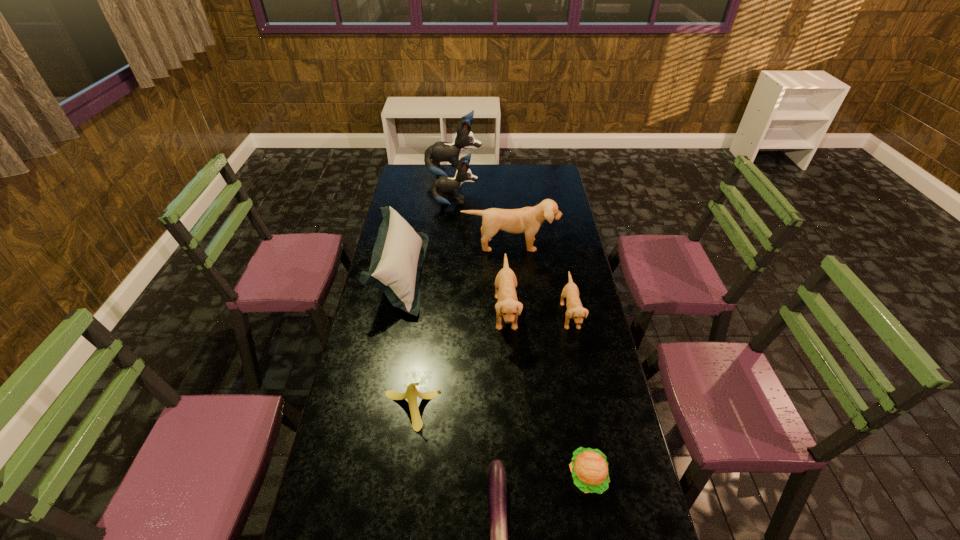
This screenshot has width=960, height=540. What are the coordinates of `the tallest puppy` in the screenshot? It's located at (440, 151).

Image resolution: width=960 pixels, height=540 pixels. What are the coordinates of `the tallest object` in the screenshot? It's located at (440, 151).

At what (x,y) coordinates should I click in order to perform the action: click on the fourth nearest puppy. Please return your answer as a coordinate pair (x, y). Image resolution: width=960 pixels, height=540 pixels. Looking at the image, I should click on (444, 184).

Identify the location of the nearer black puppy. The image size is (960, 540). (444, 184).

Locate an element on the screen. Image resolution: width=960 pixels, height=540 pixels. the biggest beige puppy is located at coordinates (528, 220).

Identify the location of the third nearest puppy. (528, 220).

Identify the location of white cushion. (398, 254).

In order to click on the fourth tallest puppy in this screenshot , I will do `click(508, 306)`.

This screenshot has height=540, width=960. In order to click on the smallest beige puppy in this screenshot , I will do `click(575, 310)`.

The width and height of the screenshot is (960, 540). Find the location of `banana`. banana is located at coordinates (411, 393).